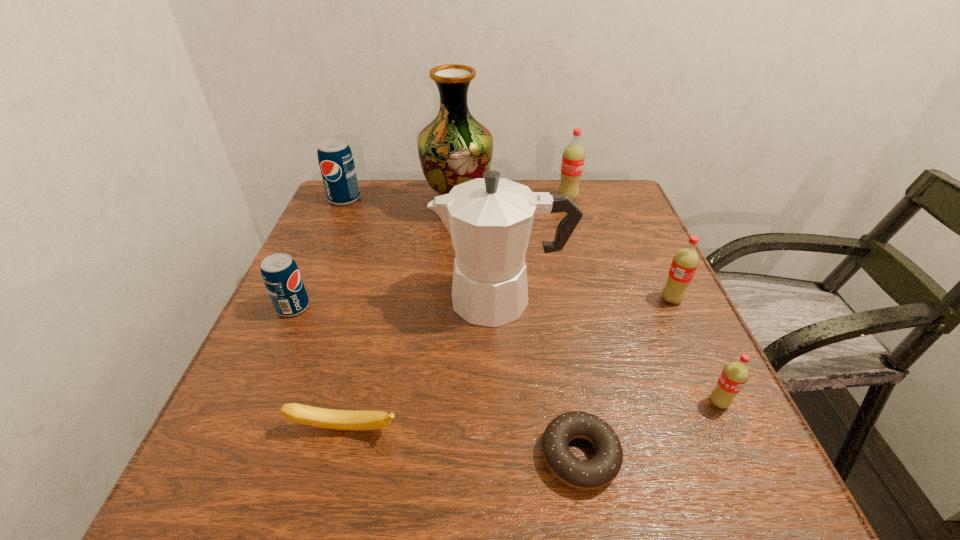
This screenshot has width=960, height=540. Identify the location of red soda object that ranks as the closest to the bigger blue pop. (573, 157).

Identify the location of the third closest red soda to the smaller blue pop. The image size is (960, 540). (734, 376).

Where is `vacant area that satisfies the following two spatial constraints: 1. on the front side of the farther blue pop; 2. on the left side of the doughnut`? Image resolution: width=960 pixels, height=540 pixels. vacant area that satisfies the following two spatial constraints: 1. on the front side of the farther blue pop; 2. on the left side of the doughnut is located at coordinates (231, 456).

Identify the location of vacant area in the image that satisfies the following two spatial constraints: 1. at the spout of the second tallest object; 2. at the stem of the yellow banana. Image resolution: width=960 pixels, height=540 pixels. (509, 429).

You are a GUI agent. You are given a task and a screenshot of the screen. Output one action in this format:
    pyautogui.click(x=<x>, y=<y>)
    Task: Click on the free location that satisfies the following two spatial constraints: 1. at the spout of the gray coffeepot; 2. on the left side of the doughnut
    This screenshot has width=960, height=540.
    Given the screenshot: What is the action you would take?
    pyautogui.click(x=510, y=456)

This screenshot has height=540, width=960. Find the location of `vacant area that satisfies the following two spatial constraints: 1. on the front side of the third tallest object; 2. on the right side of the second smallest red soda`. vacant area that satisfies the following two spatial constraints: 1. on the front side of the third tallest object; 2. on the right side of the second smallest red soda is located at coordinates (596, 299).

Locate an element on the screen. The width and height of the screenshot is (960, 540). free location that satisfies the following two spatial constraints: 1. at the spout of the coffeepot; 2. on the right side of the smallest red soda is located at coordinates (507, 402).